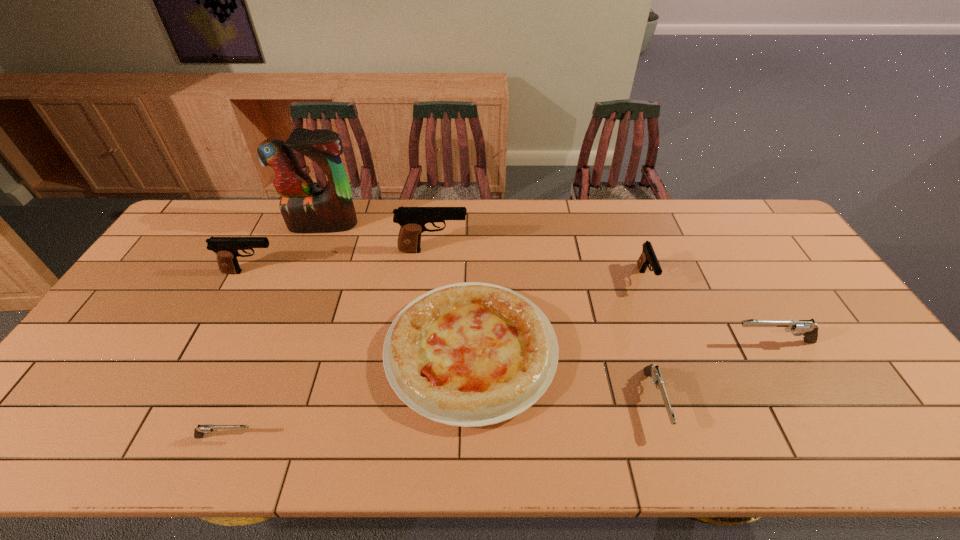
The image size is (960, 540). What are the coordinates of `the third closest pistol to the pizza` in the screenshot? It's located at (199, 431).

Point out which pistol is positioned as the second nearest to the farthest object. Please provide its 2D coordinates. Your answer should be formatted as a tuple, i.e. [(x, y)], where the tuple contains the x and y coordinates of a point satisfying the conditions above.

[(226, 248)]

Locate an element on the screen. Image resolution: width=960 pixels, height=540 pixels. black pistol that stands as the closest to the fifth tallest object is located at coordinates (648, 256).

Identify the location of the second closest black pistol to the seventh shortest object. The image size is (960, 540). (648, 256).

This screenshot has height=540, width=960. I want to click on the closest silver pistol to the second black pistol from left to right, so click(x=651, y=370).

Where is `silver pistol that stands as the second closest to the rightmost pistol`? silver pistol that stands as the second closest to the rightmost pistol is located at coordinates (199, 431).